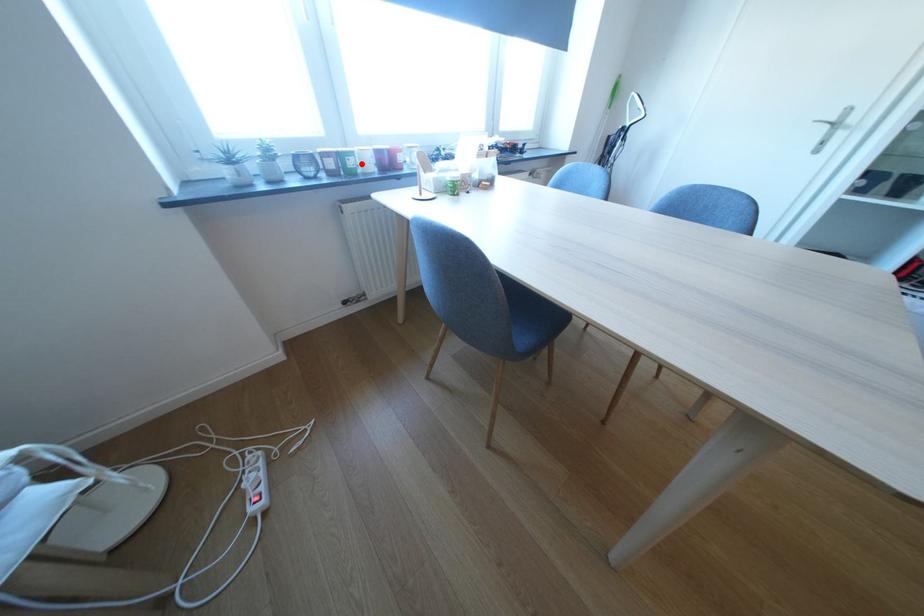
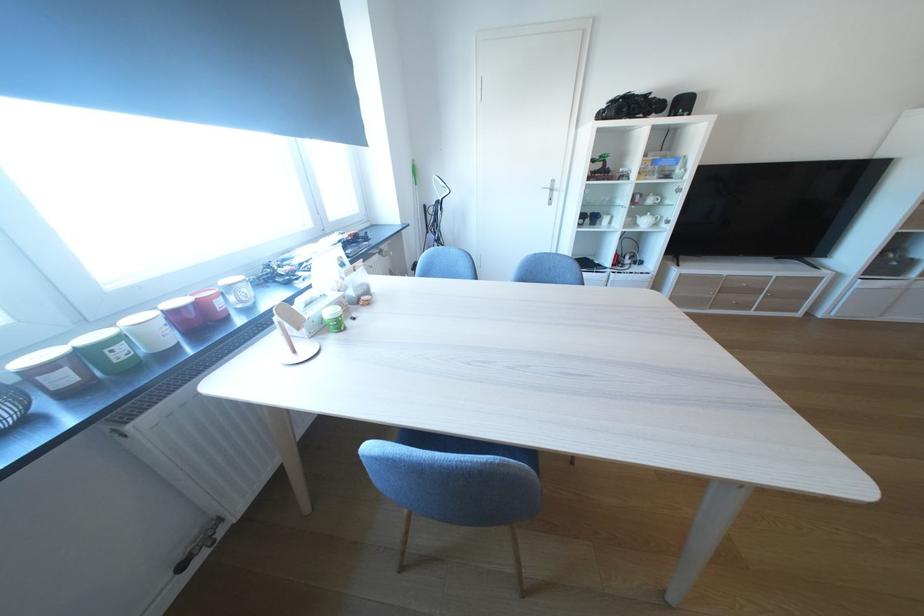
In the second image, find the point that corresponds to the highlighted location in the first image.

(129, 354)